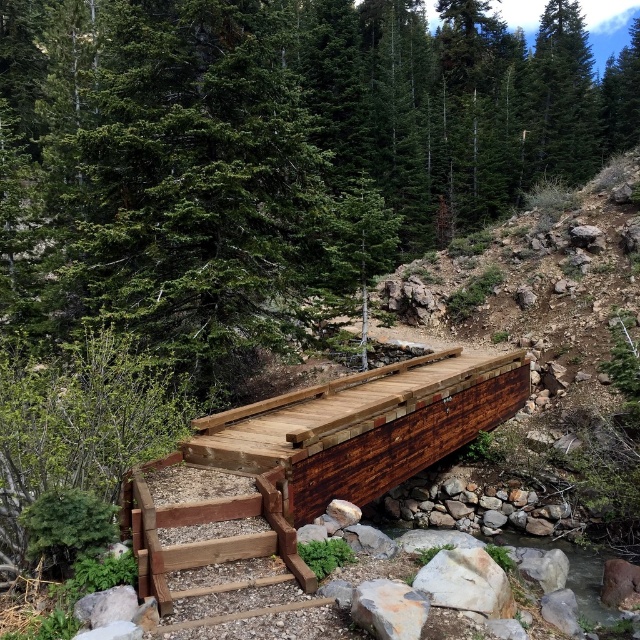
Question: Is green matte tree at center positioned before rustic wood bridge at center?

Choices:
 (A) yes
 (B) no

Answer: (B)

Question: Is green matte tree at center thinner than rustic wood bridge at center?

Choices:
 (A) yes
 (B) no

Answer: (B)

Question: Which of the following is the farthest from the observer?

Choices:
 (A) green matte tree at center
 (B) rustic wood bridge at center

Answer: (A)

Question: From the image, what is the correct spatial relationship of green matte tree at center in relation to rustic wood bridge at center?

Choices:
 (A) right
 (B) left

Answer: (A)